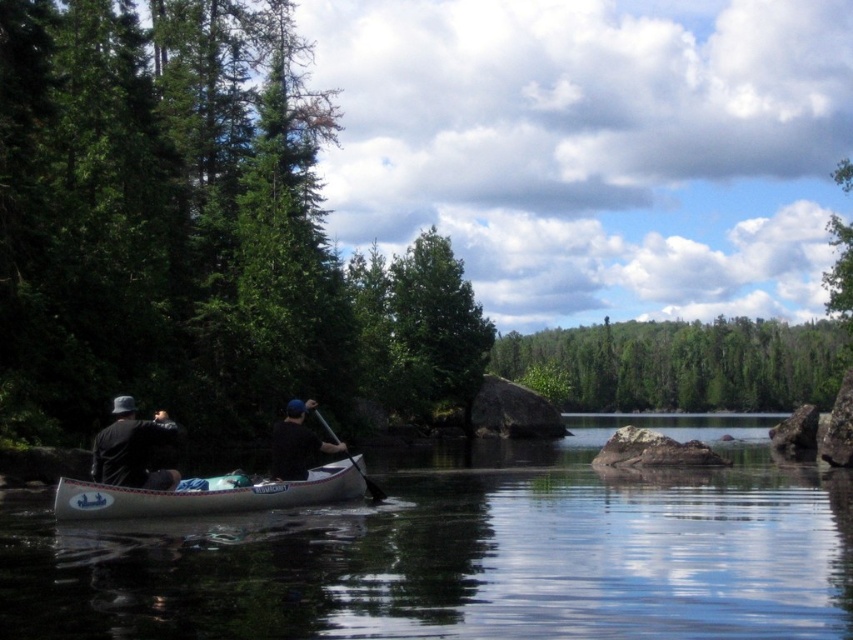
You are a drone operator trying to capture a photo of the green leafy tree at center. The drone is currently hovering at the center of the image. Based on the scene, will you need to move the drone left or right to frame the tree properly?

The green leafy tree at center is located at the point (438, 323), which is slightly to the right of the exact center. Therefore, you should move the drone slightly to the right to frame the tree properly.

You are planning to store the white plastic canoe at center and the black matte paddle at center in a storage locker. The locker has a maximum width capacity of 1.2 meters. If the paddle is 1.5 meters long, will both items fit side by side within the locker?

The white plastic canoe at center is narrower than the black matte paddle at center. Since the paddle is 1.5 meters long and the locker can only hold up to 1.2 meters in width, the combined width of both items exceeds the locker capacity. Therefore, they cannot fit side by side.